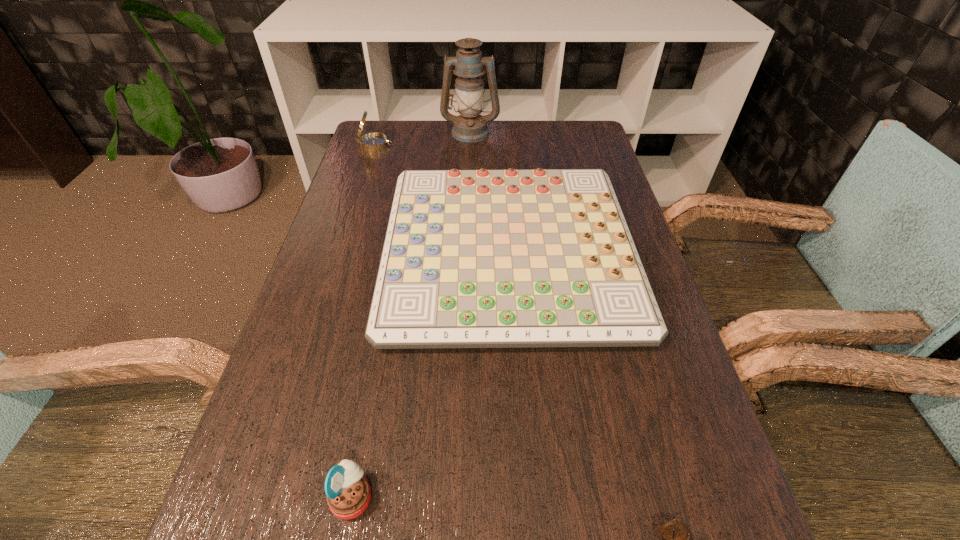
This screenshot has height=540, width=960. What are the coordinates of `vacant space that satisfies the following two spatial constraints: 1. with the dial facing the gameboard; 2. on the right side of the farther compass` in the screenshot? It's located at (342, 252).

I want to click on free space that satisfies the following two spatial constraints: 1. with the dial facing the gameboard; 2. on the left side of the leftmost object, so click(x=342, y=252).

In order to click on vacant space that satisfies the following two spatial constraints: 1. with the dial facing the gameboard; 2. on the right side of the left compass in this screenshot , I will do `click(342, 252)`.